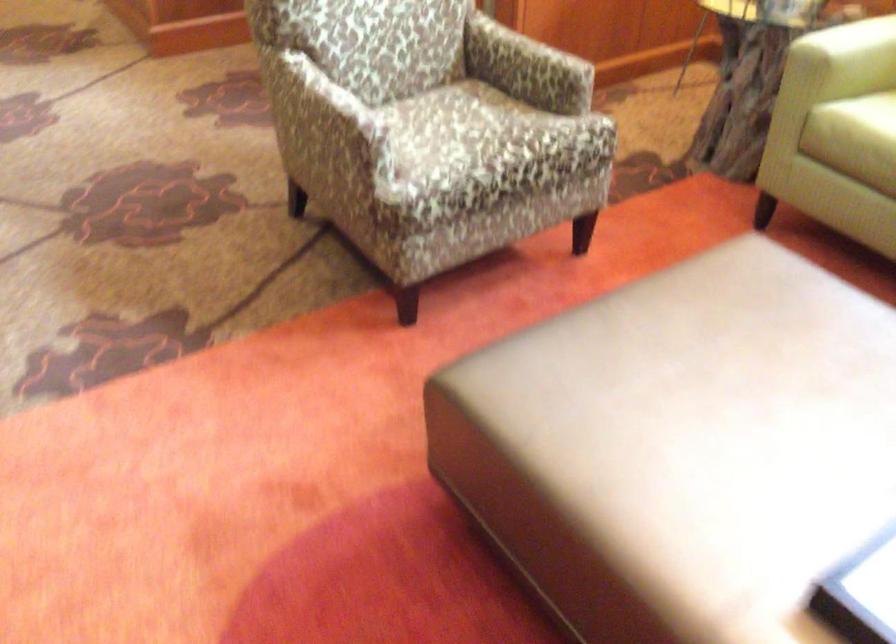
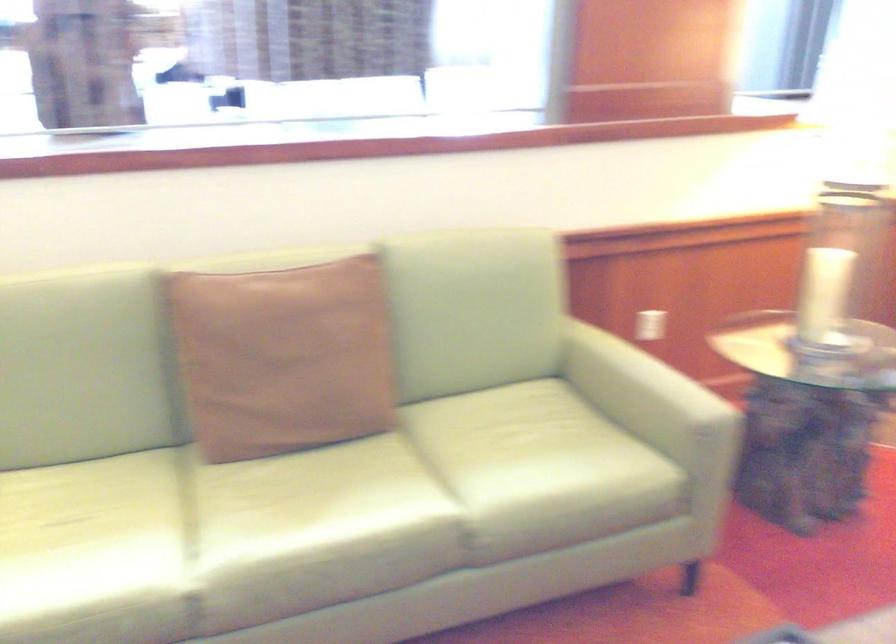
Question: The camera is either moving clockwise (left) or counter-clockwise (right) around the object. The first image is from the beginning of the video and the second image is from the end. Is the camera moving left or right when shooting the video?

Choices:
 (A) Left
 (B) Right

Answer: (A)